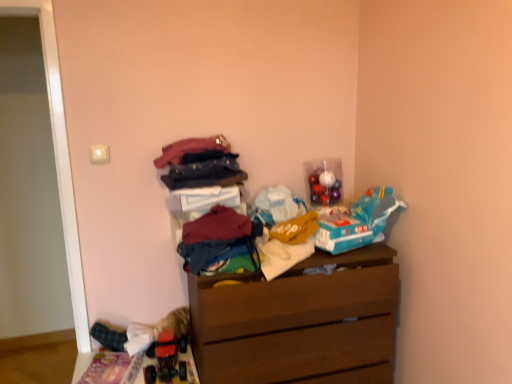
Question: Can you confirm if shiny metallic ornaments at upper right, the first toy positioned from the top, is smaller than matte pink fabric at upper center, marked as the third clothing in a bottom-to-top arrangement?

Choices:
 (A) no
 (B) yes

Answer: (B)

Question: From a real-world perspective, is shiny metallic ornaments at upper right, placed as the 1th toy when sorted from back to front, below matte pink fabric at upper center, marked as the first clothing in a top-to-bottom arrangement?

Choices:
 (A) yes
 (B) no

Answer: (A)

Question: Is the position of shiny metallic ornaments at upper right, placed as the 1th toy when sorted from back to front, more distant than that of matte pink fabric at upper center, marked as the third clothing in a bottom-to-top arrangement?

Choices:
 (A) yes
 (B) no

Answer: (A)

Question: Considering the relative sizes of shiny metallic ornaments at upper right, the 2th toy when ordered from bottom to top, and matte pink fabric at upper center, marked as the first clothing in a top-to-bottom arrangement, in the image provided, is shiny metallic ornaments at upper right, the 2th toy when ordered from bottom to top, bigger than matte pink fabric at upper center, marked as the first clothing in a top-to-bottom arrangement,?

Choices:
 (A) no
 (B) yes

Answer: (A)

Question: From a real-world perspective, is shiny metallic ornaments at upper right, the second toy positioned from the left, physically above matte pink fabric at upper center, marked as the first clothing in a top-to-bottom arrangement?

Choices:
 (A) no
 (B) yes

Answer: (A)

Question: Is rubberized plastic toy car at lower left, the 2th toy viewed from the back, to the left or to the right of shiny metallic ornaments at upper right, the 2th toy when ordered from bottom to top, in the image?

Choices:
 (A) right
 (B) left

Answer: (B)

Question: Considering the positions of rubberized plastic toy car at lower left, the second toy positioned from the right, and shiny metallic ornaments at upper right, marked as the 2th toy in a front-to-back arrangement, in the image, is rubberized plastic toy car at lower left, the second toy positioned from the right, taller or shorter than shiny metallic ornaments at upper right, marked as the 2th toy in a front-to-back arrangement,?

Choices:
 (A) tall
 (B) short

Answer: (B)

Question: Do you think rubberized plastic toy car at lower left, the 2th toy viewed from the back, is within shiny metallic ornaments at upper right, the second toy positioned from the left, or outside of it?

Choices:
 (A) inside
 (B) outside

Answer: (B)

Question: Relative to shiny metallic ornaments at upper right, placed as the 1th toy when sorted from back to front, is rubberized plastic toy car at lower left, acting as the first toy starting from the bottom, in front or behind?

Choices:
 (A) behind
 (B) front

Answer: (B)

Question: Is shiny metallic ornaments at upper right, placed as the 1th toy when sorted from back to front, taller or shorter than brown wooden chest of drawers at center?

Choices:
 (A) short
 (B) tall

Answer: (A)

Question: Is shiny metallic ornaments at upper right, placed as the 1th toy when sorted from back to front, wider or thinner than brown wooden chest of drawers at center?

Choices:
 (A) wide
 (B) thin

Answer: (B)

Question: From the image's perspective, relative to brown wooden chest of drawers at center, is shiny metallic ornaments at upper right, the first toy positioned from the top, above or below?

Choices:
 (A) below
 (B) above

Answer: (B)

Question: Considering the positions of point (308, 183) and point (364, 382), is point (308, 183) closer or farther from the camera than point (364, 382)?

Choices:
 (A) farther
 (B) closer

Answer: (A)

Question: Would you say multicolored fabric pile at center, which is the third clothing from top to bottom, is inside or outside matte pink fabric at upper center, marked as the third clothing in a bottom-to-top arrangement?

Choices:
 (A) outside
 (B) inside

Answer: (A)

Question: From their relative heights in the image, would you say multicolored fabric pile at center, acting as the 1th clothing starting from the bottom, is taller or shorter than matte pink fabric at upper center, marked as the third clothing in a bottom-to-top arrangement?

Choices:
 (A) tall
 (B) short

Answer: (A)